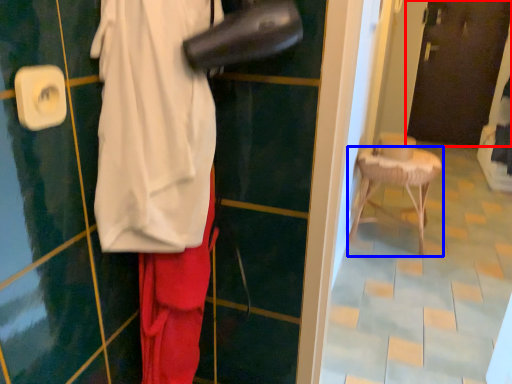
Question: Which of the following is the farthest to the observer, door (highlighted by a red box) or furniture (highlighted by a blue box)?

Choices:
 (A) door
 (B) furniture

Answer: (A)